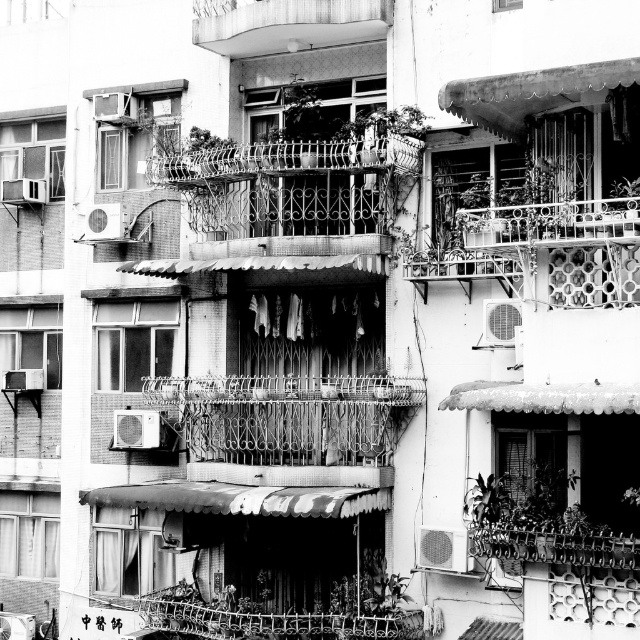
You are a delivery person trying to locate a specific balcony for a package delivery. The recipient mentioned their balcony is at point (550, 224). Which balcony should you look for?

A: The rusty metal balcony at upper right is located at point (550, 224).

You are a window washer standing on the metallic balcony at upper center and need to reach the rusty metal balcony at upper right. Considering their thickness, which balcony would be more stable to stand on?

The rusty metal balcony at upper right is thicker than the metallic balcony at upper center, so it would be more stable to stand on.